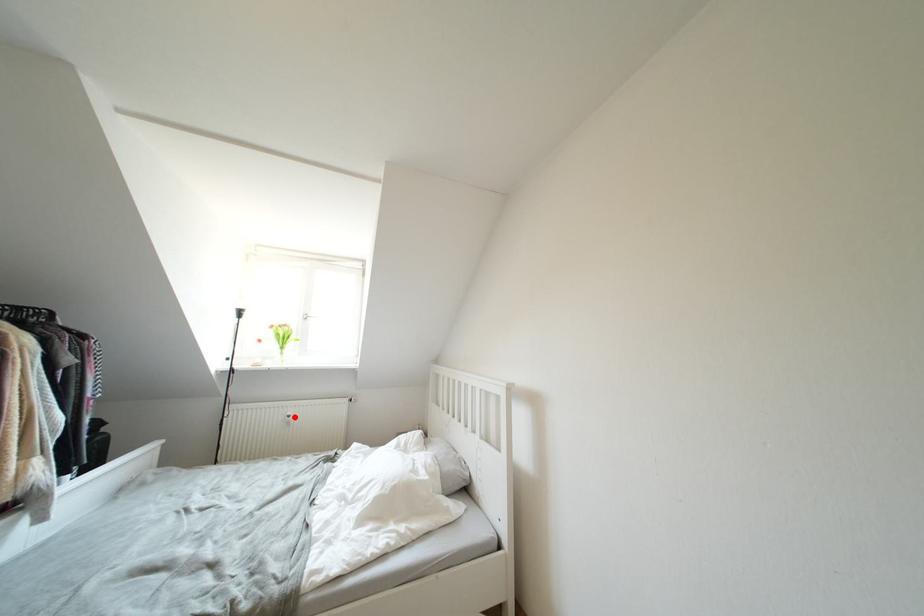
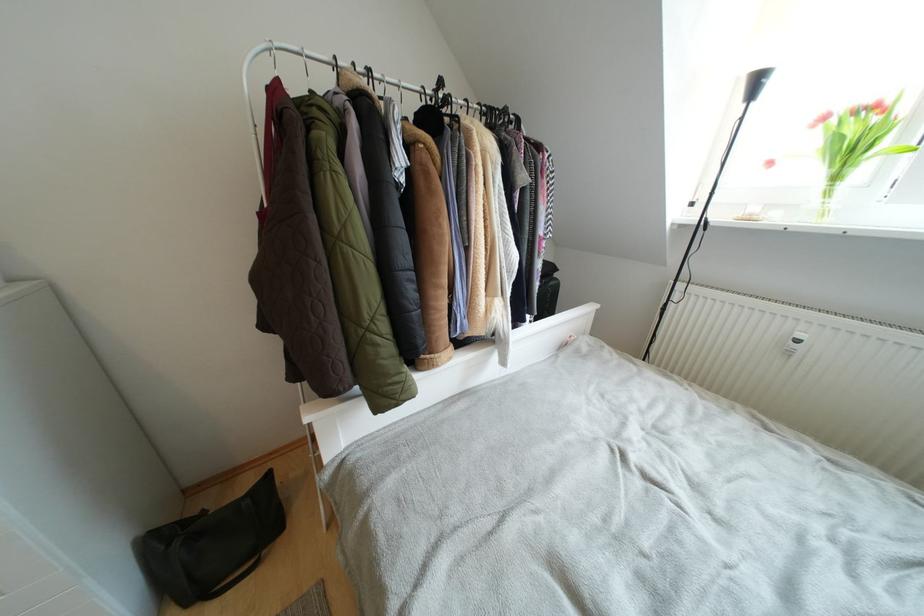
The point at the highlighted location is marked in the first image. Where is the corresponding point in the second image?

(805, 339)